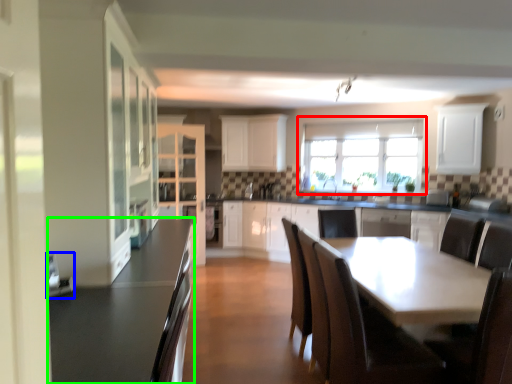
Question: Which object is positioned closest to window (highlighted by a red box)? Select from appliance (highlighted by a blue box) and countertop (highlighted by a green box).

Choices:
 (A) appliance
 (B) countertop

Answer: (B)